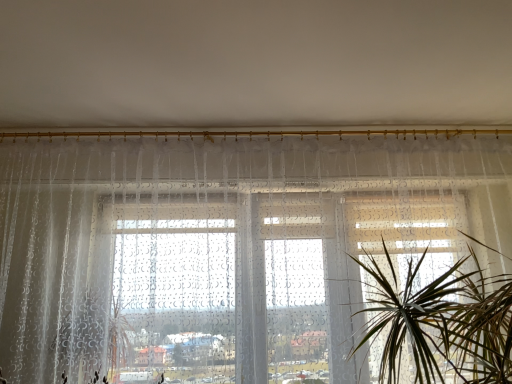
Based on the photo, in order to face green leafy plant at center, should I rotate leftwards or rightwards?

To face it directly, rotate right by 27.627 degrees.

What do you see at coordinates (443, 323) in the screenshot? I see `green leafy plant at center` at bounding box center [443, 323].

Locate an element on the screen. The height and width of the screenshot is (384, 512). green leafy plant at center is located at coordinates (443, 323).

Describe the element at coordinates (228, 248) in the screenshot. I see `transparent fabric window at center` at that location.

Image resolution: width=512 pixels, height=384 pixels. Find the location of `transparent fabric window at center`. transparent fabric window at center is located at coordinates [228, 248].

Where is `green leafy plant at center`? green leafy plant at center is located at coordinates (443, 323).

Which object is positioned more to the right, transparent fabric window at center or green leafy plant at center?

From the viewer's perspective, green leafy plant at center appears more on the right side.

Which object is further away from the camera taking this photo, transparent fabric window at center or green leafy plant at center?

transparent fabric window at center is further away from the camera.

Is point (463, 246) positioned after point (430, 351)?

Yes, it is.

From the image's perspective, does transparent fabric window at center appear higher than green leafy plant at center?

Yes.

From a real-world perspective, is transparent fabric window at center physically below green leafy plant at center?

Incorrect, from a real-world perspective, transparent fabric window at center is higher than green leafy plant at center.

Considering the sizes of objects transparent fabric window at center and green leafy plant at center in the image provided, who is thinner, transparent fabric window at center or green leafy plant at center?

transparent fabric window at center.

Which of these two, transparent fabric window at center or green leafy plant at center, stands taller?

With more height is transparent fabric window at center.

Considering the relative sizes of transparent fabric window at center and green leafy plant at center in the image provided, is transparent fabric window at center smaller than green leafy plant at center?

Incorrect, transparent fabric window at center is not smaller in size than green leafy plant at center.

Consider the image. Is transparent fabric window at center surrounding green leafy plant at center?

Definitely not — green leafy plant at center is not inside transparent fabric window at center.

Is transparent fabric window at center with green leafy plant at center?

transparent fabric window at center is not next to green leafy plant at center, and they're not touching.

Could you tell me if transparent fabric window at center is facing green leafy plant at center?

Yes.

The width and height of the screenshot is (512, 384). I want to click on window on the left of green leafy plant at center, so click(228, 248).

Considering the relative positions of green leafy plant at center and transparent fabric window at center in the image provided, is green leafy plant at center to the left of transparent fabric window at center from the viewer's perspective?

No.

Is the position of green leafy plant at center less distant than that of transparent fabric window at center?

Yes, it is in front of transparent fabric window at center.

Which is closer, (448, 317) or (426, 198)?

Clearly, point (448, 317) is closer to the camera than point (426, 198).

From the image's perspective, is green leafy plant at center on top of transparent fabric window at center?

A: Incorrect, from the image's perspective, green leafy plant at center is lower than transparent fabric window at center.

From a real-world perspective, relative to transparent fabric window at center, is green leafy plant at center vertically above or below?

green leafy plant at center is below transparent fabric window at center.

Considering the sizes of objects green leafy plant at center and transparent fabric window at center in the image provided, who is thinner, green leafy plant at center or transparent fabric window at center?

With smaller width is transparent fabric window at center.

Can you confirm if green leafy plant at center is shorter than transparent fabric window at center?

Yes, green leafy plant at center is shorter than transparent fabric window at center.

Does green leafy plant at center have a larger size compared to transparent fabric window at center?

Actually, green leafy plant at center might be smaller than transparent fabric window at center.

Based on the photo, is transparent fabric window at center inside green leafy plant at center?

That's incorrect, transparent fabric window at center is not inside green leafy plant at center.

Is green leafy plant at center positioned far away from transparent fabric window at center?

No.

Could you tell me if green leafy plant at center is facing transparent fabric window at center?

Yes.

Consider the image. How far apart are green leafy plant at center and transparent fabric window at center?

They are 22.88 inches apart.

I want to click on houseplant on the right of transparent fabric window at center, so click(443, 323).

The width and height of the screenshot is (512, 384). I want to click on window located behind the green leafy plant at center, so click(x=228, y=248).

Locate an element on the screen. This screenshot has height=384, width=512. window above the green leafy plant at center (from a real-world perspective) is located at coordinates (228, 248).